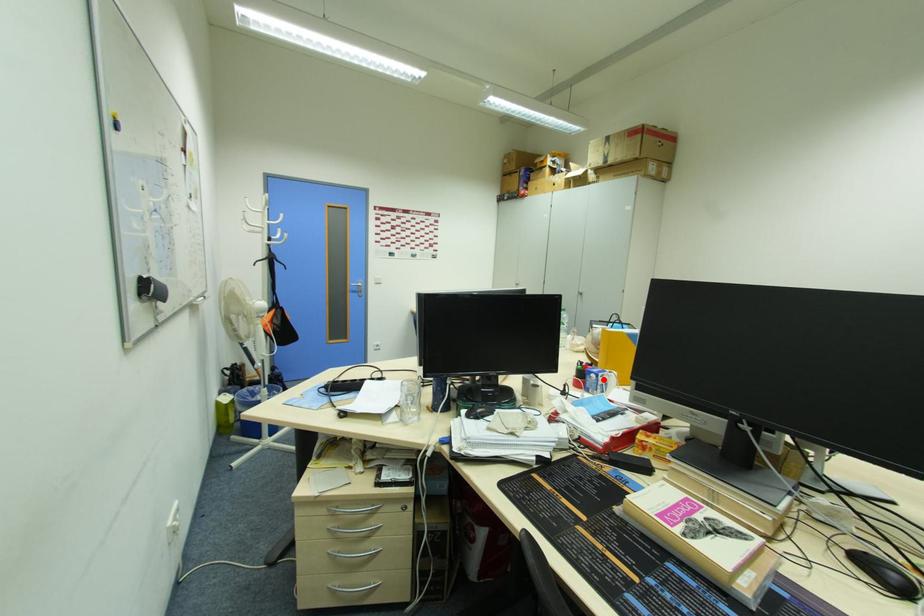
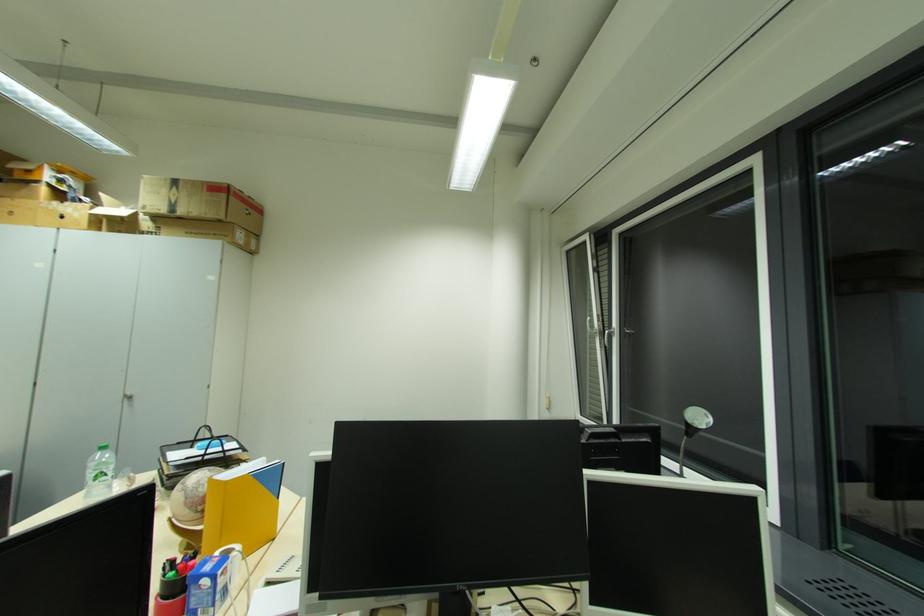
Question: I am providing you with two images of the same scene from different viewpoints. In image1, a red point is highlighted. Considering the same 3D point in image2, which of the following is correct?

Choices:
 (A) It is closer
 (B) It is farther

Answer: (A)